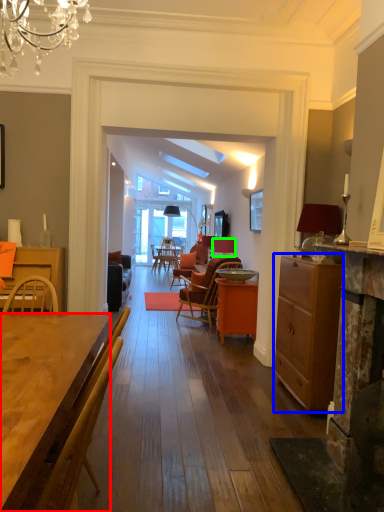
Question: Which object is positioned farthest from desk (highlighted by a red box)? Select from cabinetry (highlighted by a blue box) and loudspeaker (highlighted by a green box).

Choices:
 (A) cabinetry
 (B) loudspeaker

Answer: (B)